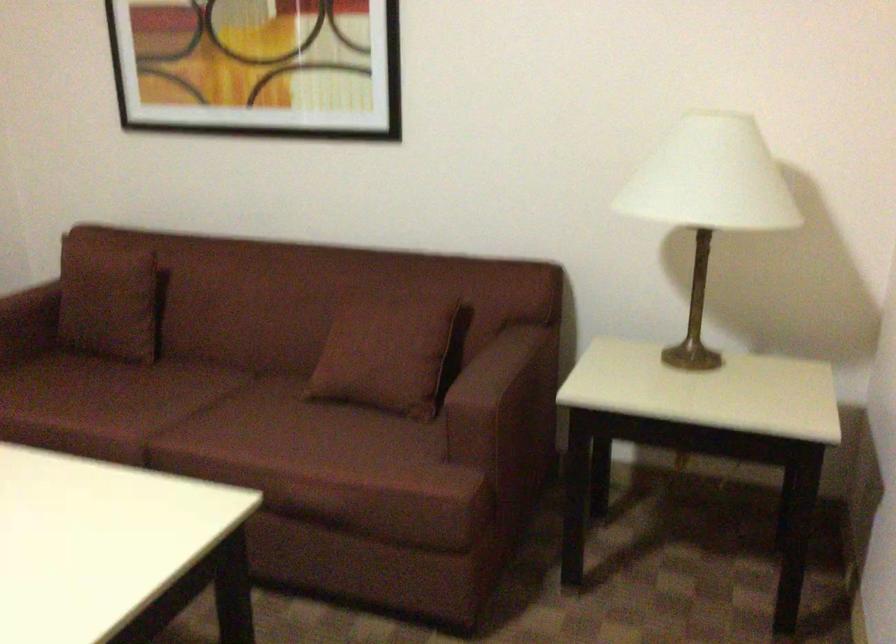
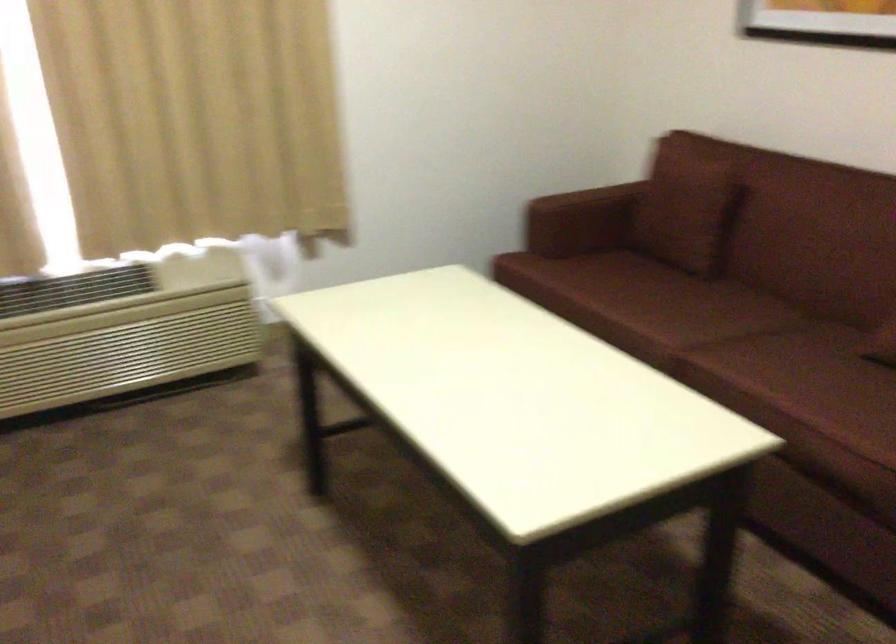
Question: The first image is from the beginning of the video and the second image is from the end. How did the camera likely rotate when shooting the video?

Choices:
 (A) Left
 (B) Right
 (C) Up
 (D) Down

Answer: (A)